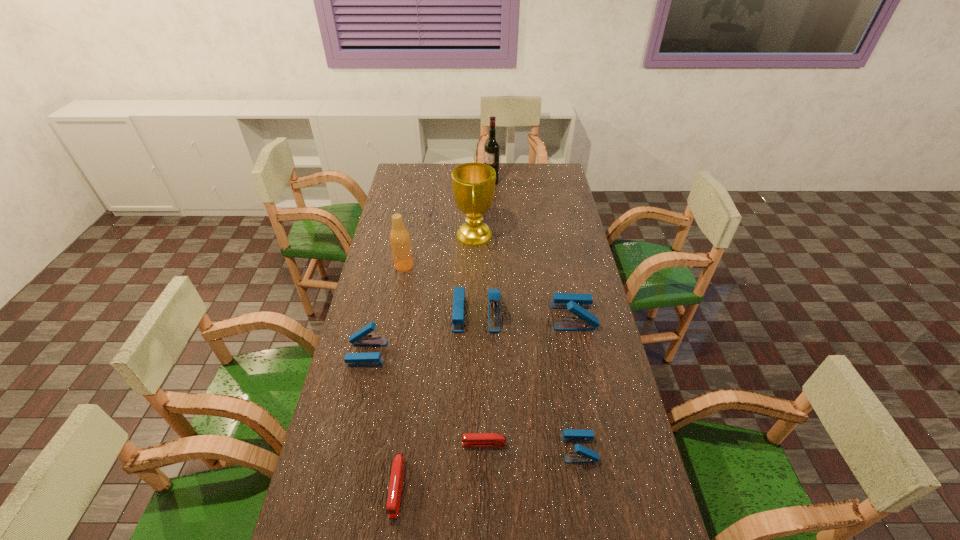
Where is `red stapler that stands as the closest to the tan beer bottle`? The height and width of the screenshot is (540, 960). red stapler that stands as the closest to the tan beer bottle is located at coordinates (468, 439).

I want to click on vacant region that satisfies the following two spatial constraints: 1. on the back side of the nearest blue stapler; 2. on the front-facing side of the shortest object, so click(x=578, y=444).